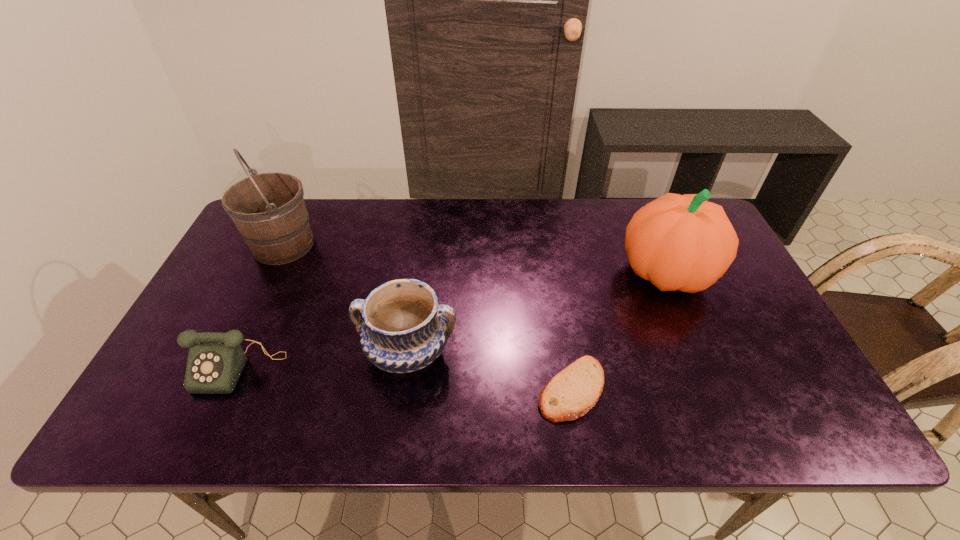
Locate an element on the screen. bucket is located at coordinates (268, 209).

The height and width of the screenshot is (540, 960). Find the location of `pumpkin`. pumpkin is located at coordinates (679, 242).

At what (x,y) coordinates should I click in order to perform the action: click on pottery. Please return your answer as a coordinate pair (x, y). Looking at the image, I should click on (404, 329).

I want to click on the third object from left to right, so click(x=404, y=329).

Locate an element on the screen. This screenshot has width=960, height=540. telephone is located at coordinates (215, 361).

In order to click on the fourth object from left to right in this screenshot , I will do `click(570, 394)`.

Locate an element on the screen. the shortest object is located at coordinates (570, 394).

Identify the location of vacant space located 0.090m on the front of the bucket. This screenshot has height=540, width=960. (261, 291).

Identify the location of free point located on the back of the rightmost object. This screenshot has height=540, width=960. (646, 226).

You are a GUI agent. You are given a task and a screenshot of the screen. Output one action in this format:
    pyautogui.click(x=<x>, y=<y>)
    Task: Click on the vacant space positioned on the back of the third object from right to left
    The height and width of the screenshot is (540, 960).
    Given the screenshot: What is the action you would take?
    pyautogui.click(x=424, y=235)